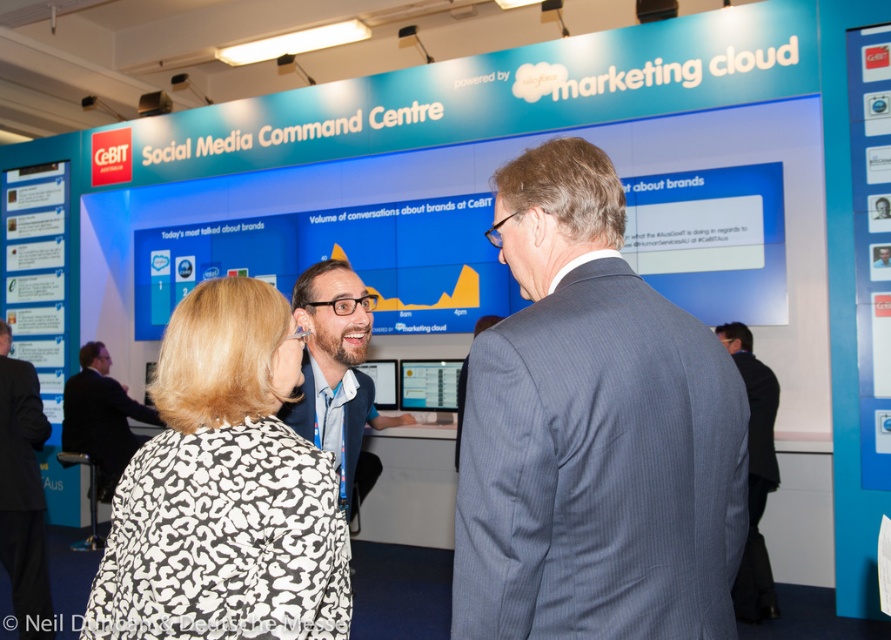
Where is `dark blue suit at center`? The width and height of the screenshot is (891, 640). dark blue suit at center is located at coordinates (101, 417).

Is dark blue suit at center shorter than blue fabric business suit at center?

In fact, dark blue suit at center may be taller than blue fabric business suit at center.

Is point (93, 432) positioned after point (350, 445)?

Yes.

Identify the location of dark blue suit at center. (101, 417).

Who is lower down, dark suit at center or blue fabric business suit at center?

Positioned lower is dark suit at center.

Is dark suit at center below blue fabric business suit at center?

Correct, dark suit at center is located below blue fabric business suit at center.

This screenshot has width=891, height=640. What do you see at coordinates (22, 492) in the screenshot?
I see `dark suit at center` at bounding box center [22, 492].

The width and height of the screenshot is (891, 640). I want to click on dark suit at center, so click(22, 492).

Is dark blue pinstripe suit at center positioned behind gray suit at center?

That is False.

Does point (522, 552) come behind point (761, 563)?

No, (522, 552) is closer to viewer.

What do you see at coordinates (593, 433) in the screenshot? The width and height of the screenshot is (891, 640). I see `dark blue pinstripe suit at center` at bounding box center [593, 433].

Locate an element on the screen. dark blue pinstripe suit at center is located at coordinates (593, 433).